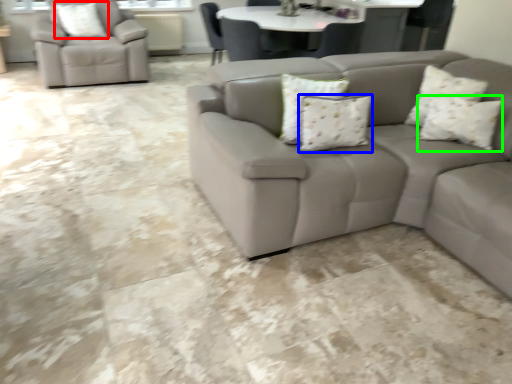
Question: Which is nearer to the pillow (highlighted by a red box)? pillow (highlighted by a blue box) or pillow (highlighted by a green box).

Choices:
 (A) pillow
 (B) pillow

Answer: (A)